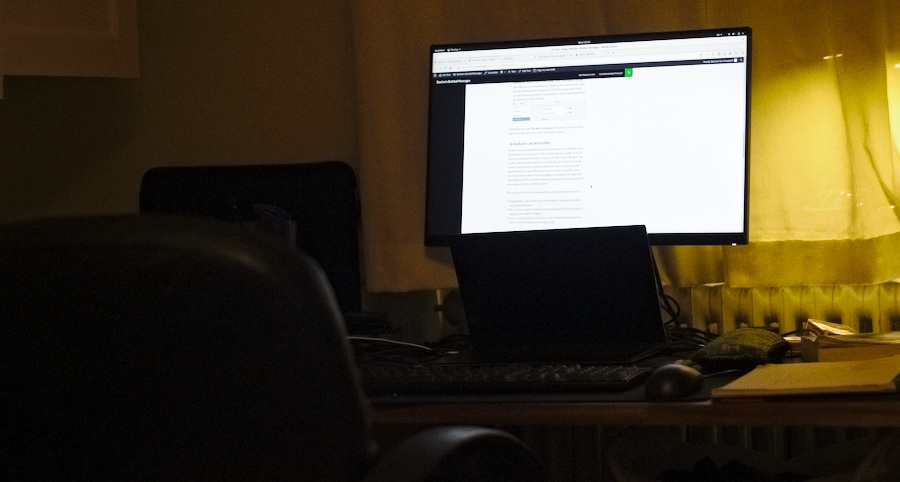
You are a GUI agent. You are given a task and a screenshot of the screen. Output one action in this format:
    pyautogui.click(x=<x>, y=<y>)
    Task: Click on the back of chair
    Image resolution: width=900 pixels, height=482 pixels.
    Given the screenshot: What is the action you would take?
    [x=198, y=361]